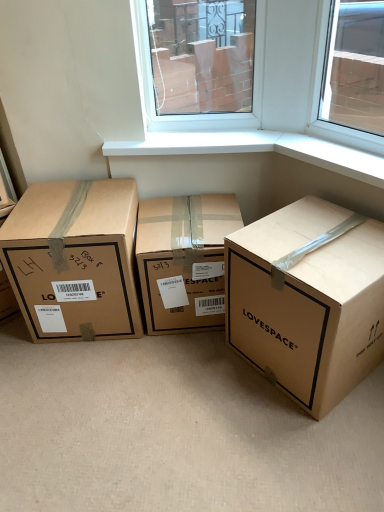
Identify the location of free space above brown cardboard box at center, the 2th box from the right (from a real-world perspective). Image resolution: width=384 pixels, height=512 pixels. (197, 208).